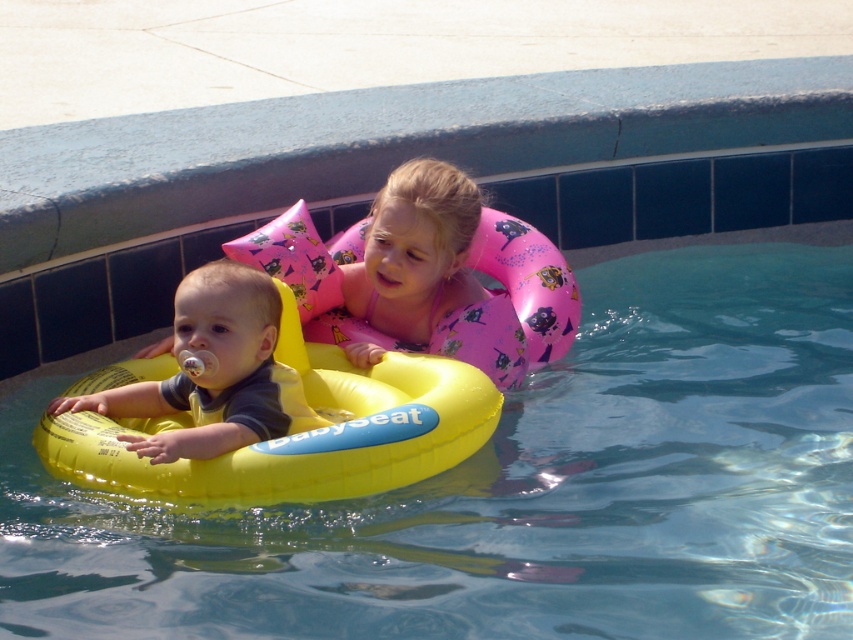
Question: Where is pink rubber ring at center located in relation to yellow rubber ring at left in the image?

Choices:
 (A) left
 (B) right

Answer: (B)

Question: Does pink rubber ring at center have a smaller size compared to yellow rubber ring at left?

Choices:
 (A) no
 (B) yes

Answer: (B)

Question: Which point is farther to the camera?

Choices:
 (A) (253, 285)
 (B) (358, 352)

Answer: (B)

Question: Which point is farther to the camera?

Choices:
 (A) yellow rubber ring at left
 (B) pink rubber ring at center

Answer: (B)

Question: Among these points, which one is farthest from the camera?

Choices:
 (A) 450,292
 (B) 183,371

Answer: (A)

Question: Is pink rubber ring at center to the left of yellow rubber ring at left from the viewer's perspective?

Choices:
 (A) yes
 (B) no

Answer: (B)